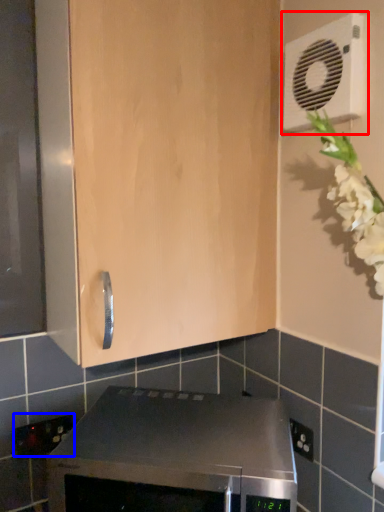
Question: Which object appears farthest to the camera in this image, air conditioning (highlighted by a red box) or electric outlet (highlighted by a blue box)?

Choices:
 (A) air conditioning
 (B) electric outlet

Answer: (B)